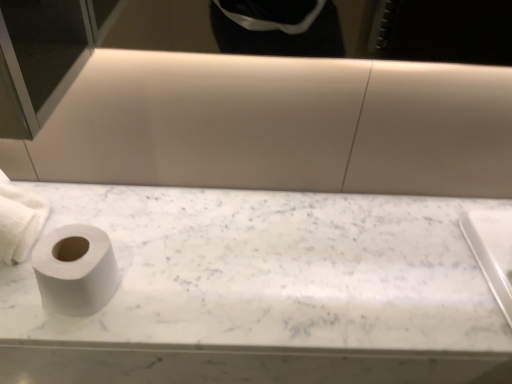
Question: Is the depth of white matte toilet paper at left, which appears as the 1th toilet paper when viewed from the right, less than that of white marble toilet paper at left?

Choices:
 (A) no
 (B) yes

Answer: (B)

Question: From a real-world perspective, is white matte toilet paper at left, the second toilet paper in the left-to-right sequence, under white marble toilet paper at left?

Choices:
 (A) no
 (B) yes

Answer: (A)

Question: Considering the relative sizes of white matte toilet paper at left, the second toilet paper in the left-to-right sequence, and white marble toilet paper at left in the image provided, is white matte toilet paper at left, the second toilet paper in the left-to-right sequence, shorter than white marble toilet paper at left?

Choices:
 (A) no
 (B) yes

Answer: (A)

Question: Is white matte toilet paper at left, the second toilet paper in the left-to-right sequence, facing away from white marble toilet paper at left?

Choices:
 (A) no
 (B) yes

Answer: (A)

Question: Considering the relative positions of white matte toilet paper at left, which appears as the 1th toilet paper when viewed from the right, and white marble toilet paper at left in the image provided, is white matte toilet paper at left, which appears as the 1th toilet paper when viewed from the right, to the left of white marble toilet paper at left from the viewer's perspective?

Choices:
 (A) yes
 (B) no

Answer: (A)

Question: Is white matte toilet paper at left, the second toilet paper from the right, bigger or smaller than white marble toilet paper at left?

Choices:
 (A) big
 (B) small

Answer: (B)

Question: Is white matte toilet paper at left, the second toilet paper from the right, taller or shorter than white marble toilet paper at left?

Choices:
 (A) short
 (B) tall

Answer: (B)

Question: Is white matte toilet paper at left, which is the 1th toilet paper in left-to-right order, to the left or to the right of white marble toilet paper at left in the image?

Choices:
 (A) left
 (B) right

Answer: (A)

Question: Is point (9, 200) positioned closer to the camera than point (154, 354)?

Choices:
 (A) closer
 (B) farther

Answer: (B)

Question: From their relative heights in the image, would you say white matte toilet paper at left, which appears as the 1th toilet paper when viewed from the right, is taller or shorter than white marble toilet paper at left?

Choices:
 (A) short
 (B) tall

Answer: (B)

Question: Is white matte toilet paper at left, which appears as the 1th toilet paper when viewed from the right, inside the boundaries of white marble toilet paper at left, or outside?

Choices:
 (A) outside
 (B) inside

Answer: (A)

Question: From a real-world perspective, relative to white marble toilet paper at left, is white matte toilet paper at left, which appears as the 1th toilet paper when viewed from the right, vertically above or below?

Choices:
 (A) above
 (B) below

Answer: (A)

Question: Is point (101, 302) positioned closer to the camera than point (153, 347)?

Choices:
 (A) closer
 (B) farther

Answer: (B)

Question: In terms of height, does white matte toilet paper at left, which appears as the 1th toilet paper when viewed from the right, look taller or shorter compared to white matte toilet paper at left, the second toilet paper from the right?

Choices:
 (A) short
 (B) tall

Answer: (A)

Question: Considering their positions, is white matte toilet paper at left, which appears as the 1th toilet paper when viewed from the right, located in front of or behind white matte toilet paper at left, the second toilet paper from the right?

Choices:
 (A) front
 (B) behind

Answer: (A)